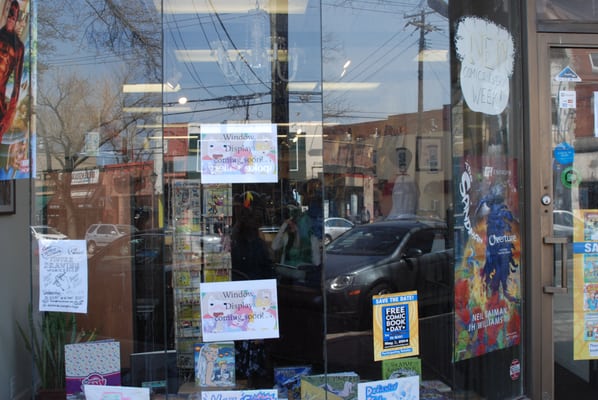
This screenshot has width=598, height=400. What are the coordinates of `outlet, electrical` in the screenshot? It's located at (13, 383).